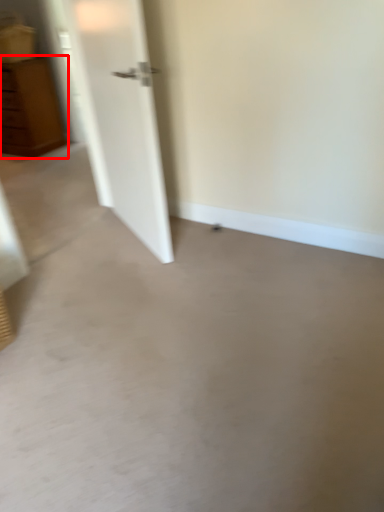
Question: In this image, where is chest of drawers (annotated by the red box) located relative to concrete?

Choices:
 (A) left
 (B) right

Answer: (A)